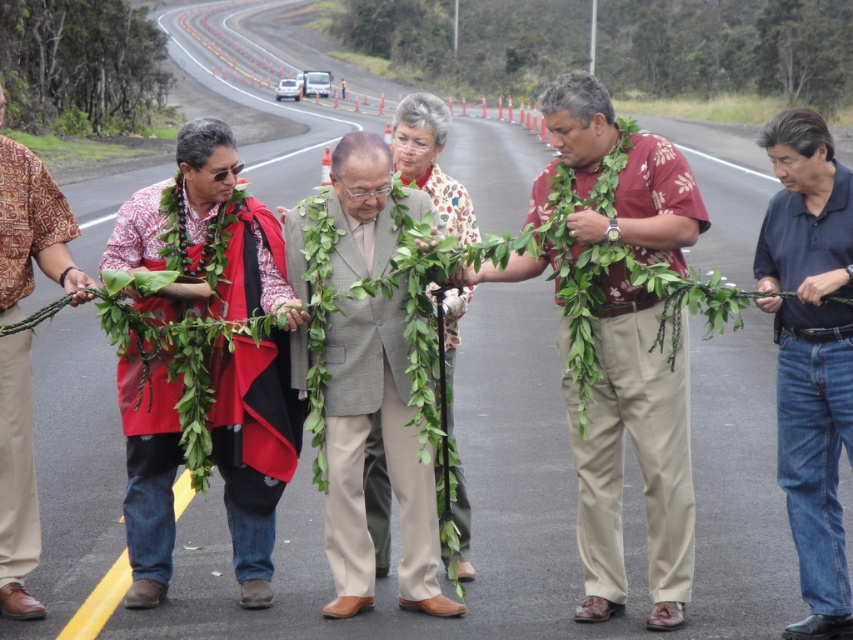
You are organizing a photo shoot and need to arrange the subjects based on their clothing sizes. Given the gray suit at center and the matte red shirt at left, which clothing item should be placed in a position that requires more space?

The gray suit at center should be placed in the position requiring more space since it has a larger size compared to the matte red shirt at left.

You are organizing a photo shoot and need to ensure that the matte red shawl at center and the matte red shirt at left are visible in the frame. Given their sizes, which one requires a wider camera angle to capture fully?

The matte red shawl at center requires a wider camera angle to capture fully since its width is larger than the matte red shirt at left.